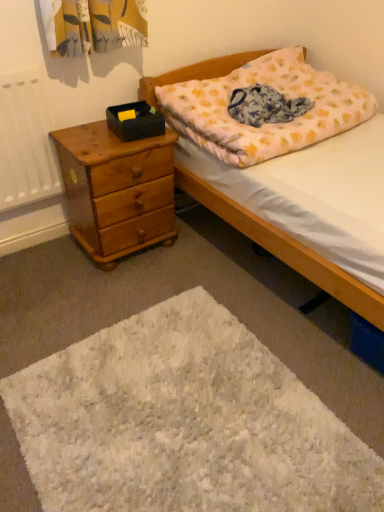
Question: Can fluffy cotton pillow at upper right be found inside white fluffy mat at lower center?

Choices:
 (A) no
 (B) yes

Answer: (A)

Question: From the image's perspective, is white fluffy mat at lower center located above fluffy cotton pillow at upper right?

Choices:
 (A) yes
 (B) no

Answer: (B)

Question: Considering the relative sizes of white fluffy mat at lower center and fluffy cotton pillow at upper right in the image provided, is white fluffy mat at lower center taller than fluffy cotton pillow at upper right?

Choices:
 (A) yes
 (B) no

Answer: (B)

Question: Is there a large distance between white fluffy mat at lower center and fluffy cotton pillow at upper right?

Choices:
 (A) no
 (B) yes

Answer: (A)

Question: Does white fluffy mat at lower center touch fluffy cotton pillow at upper right?

Choices:
 (A) yes
 (B) no

Answer: (B)

Question: Considering the relative sizes of white fluffy mat at lower center and fluffy cotton pillow at upper right in the image provided, is white fluffy mat at lower center smaller than fluffy cotton pillow at upper right?

Choices:
 (A) yes
 (B) no

Answer: (A)

Question: Considering the relative sizes of light brown wooden chest of drawers at left and floral cotton blanket at center in the image provided, is light brown wooden chest of drawers at left smaller than floral cotton blanket at center?

Choices:
 (A) no
 (B) yes

Answer: (A)

Question: Does light brown wooden chest of drawers at left come in front of floral cotton blanket at center?

Choices:
 (A) no
 (B) yes

Answer: (B)

Question: From a real-world perspective, is light brown wooden chest of drawers at left over floral cotton blanket at center?

Choices:
 (A) no
 (B) yes

Answer: (A)

Question: Can you confirm if light brown wooden chest of drawers at left is thinner than floral cotton blanket at center?

Choices:
 (A) yes
 (B) no

Answer: (B)

Question: Is light brown wooden chest of drawers at left outside floral cotton blanket at center?

Choices:
 (A) no
 (B) yes

Answer: (B)

Question: Can you confirm if light brown wooden chest of drawers at left is shorter than floral cotton blanket at center?

Choices:
 (A) yes
 (B) no

Answer: (B)

Question: Would you say white fluffy mat at lower center is a long distance from light brown wooden chest of drawers at left?

Choices:
 (A) no
 (B) yes

Answer: (A)